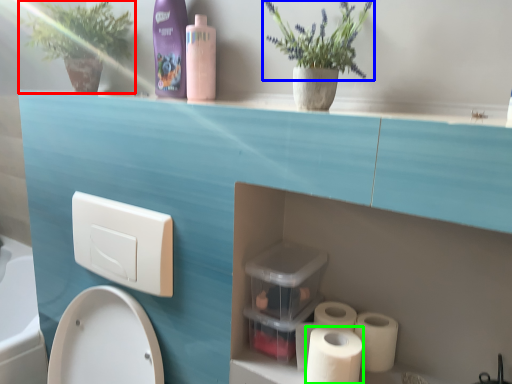
Question: Considering the real-world distances, which object is closest to plant (highlighted by a red box)? flower (highlighted by a blue box) or toilet paper (highlighted by a green box).

Choices:
 (A) flower
 (B) toilet paper

Answer: (A)